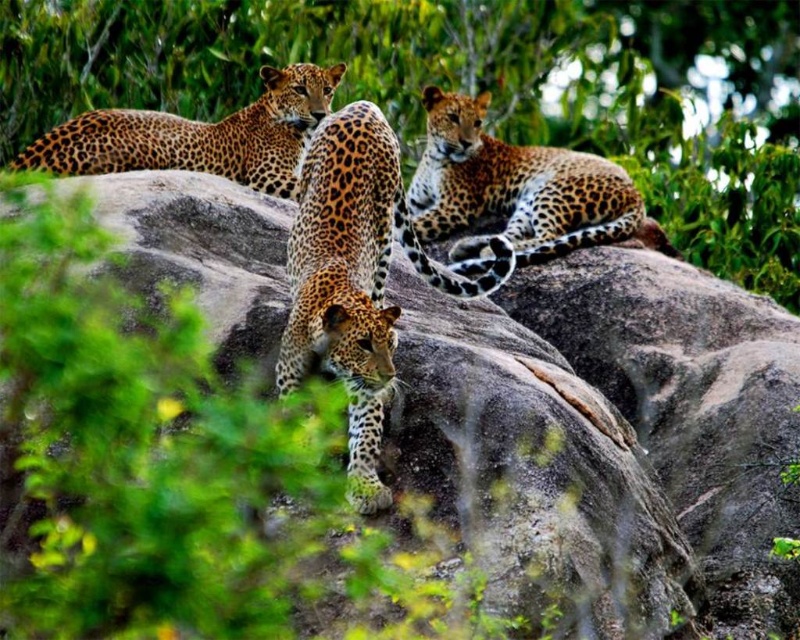
You are a photographer standing in front of the rock formation where the three leopards are resting. You notice two specific points on the rock surface marked as point 1 and point 2. Point 1 is located at coordinates (554, 154) and point 2 is at (44, 160). If you want to take a closeup photo of the point that is closer to you, which point should you focus on?

Point 2 at coordinates (44, 160) is closer to you than point 1 at (554, 154), so you should focus on point 2 for a closeup photo.

You are a wildlife photographer observing the scene. You notice two big cats, the spotted fur cheetah at center and the spotted fur leopard at upper left. Which one is positioned more to the right side of the image?

The spotted fur cheetah at center is positioned more to the right side of the image compared to the spotted fur leopard at upper left.

You are a wildlife photographer aiming to capture a photo of the spotted fur cheetah at center. Given that your camera has a focal length of 200mm and you are positioned 10 meters away from the rock formation, can you estimate whether the cheetah will be in the center of your photo based on its position coordinates?

The spotted fur cheetah at center is located at point coordinates, so it will be in the center of the photo.